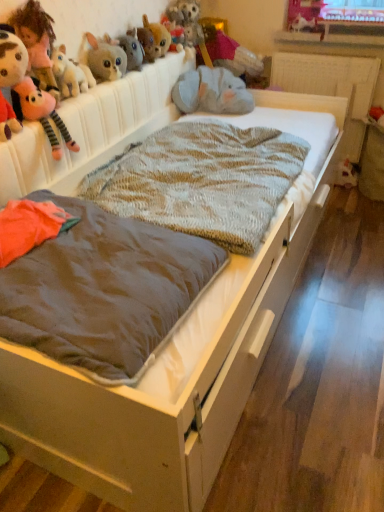
Question: Is fuzzy gray elephant at upper center, arranged as the 3th toy when viewed from the right, taller than fuzzy brown plush at upper center, acting as the 5th toy starting from the left?

Choices:
 (A) no
 (B) yes

Answer: (A)

Question: Does fuzzy gray elephant at upper center, arranged as the 3th toy when viewed from the right, turn towards fuzzy brown plush at upper center, marked as the sixth toy in a right-to-left arrangement?

Choices:
 (A) yes
 (B) no

Answer: (B)

Question: Is fuzzy brown plush at upper center, marked as the sixth toy in a right-to-left arrangement, inside fuzzy gray elephant at upper center, arranged as the 3th toy when viewed from the right?

Choices:
 (A) yes
 (B) no

Answer: (B)

Question: Is fuzzy gray elephant at upper center, arranged as the 3th toy when viewed from the right, with fuzzy brown plush at upper center, marked as the sixth toy in a right-to-left arrangement?

Choices:
 (A) no
 (B) yes

Answer: (A)

Question: Is fuzzy gray elephant at upper center, acting as the 8th toy starting from the left, positioned with its back to fuzzy brown plush at upper center, acting as the 5th toy starting from the left?

Choices:
 (A) yes
 (B) no

Answer: (B)

Question: From a real-world perspective, is fuzzy gray elephant at upper center, acting as the 8th toy starting from the left, located higher than fuzzy brown plush at upper center, acting as the 5th toy starting from the left?

Choices:
 (A) no
 (B) yes

Answer: (A)

Question: From the image's perspective, is fuzzy brown plush at upper center, acting as the 5th toy starting from the left, on top of fluffy pink plush at upper left, the first toy viewed from the left?

Choices:
 (A) yes
 (B) no

Answer: (A)

Question: From a real-world perspective, is fuzzy brown plush at upper center, acting as the 5th toy starting from the left, positioned over fluffy pink plush at upper left, the first toy viewed from the left, based on gravity?

Choices:
 (A) no
 (B) yes

Answer: (A)

Question: Is fuzzy brown plush at upper center, acting as the 5th toy starting from the left, next to fluffy pink plush at upper left, which is counted as the tenth toy, starting from the right, and touching it?

Choices:
 (A) yes
 (B) no

Answer: (B)

Question: Is fuzzy brown plush at upper center, acting as the 5th toy starting from the left, thinner than fluffy pink plush at upper left, the first toy viewed from the left?

Choices:
 (A) yes
 (B) no

Answer: (B)

Question: Does fuzzy brown plush at upper center, acting as the 5th toy starting from the left, appear on the left side of fluffy pink plush at upper left, which is counted as the tenth toy, starting from the right?

Choices:
 (A) yes
 (B) no

Answer: (B)

Question: Does fuzzy brown plush at upper center, marked as the sixth toy in a right-to-left arrangement, have a smaller size compared to fluffy pink plush at upper left, the first toy viewed from the left?

Choices:
 (A) yes
 (B) no

Answer: (A)

Question: Would you say fluffy gray plush at upper left, marked as the 4th toy in a left-to-right arrangement, contains knitted woolen blanket at center?

Choices:
 (A) yes
 (B) no

Answer: (B)